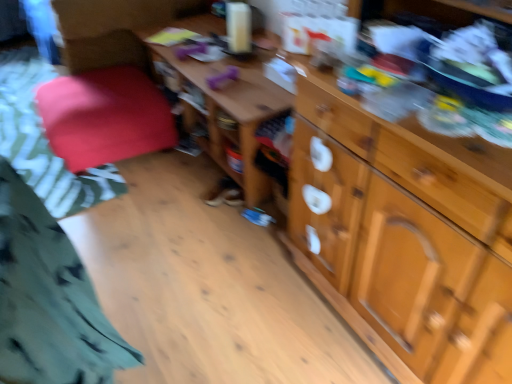
Question: Can you confirm if wooden drawer at right is taller than velvet red cushion at left?

Choices:
 (A) no
 (B) yes

Answer: (A)

Question: Considering the relative sizes of wooden drawer at right and velvet red cushion at left in the image provided, is wooden drawer at right shorter than velvet red cushion at left?

Choices:
 (A) yes
 (B) no

Answer: (A)

Question: Is wooden drawer at right closer to the viewer compared to velvet red cushion at left?

Choices:
 (A) no
 (B) yes

Answer: (B)

Question: Is wooden drawer at right outside of velvet red cushion at left?

Choices:
 (A) yes
 (B) no

Answer: (A)

Question: Considering the relative positions of wooden drawer at right and velvet red cushion at left in the image provided, is wooden drawer at right to the left of velvet red cushion at left from the viewer's perspective?

Choices:
 (A) no
 (B) yes

Answer: (A)

Question: Considering the positions of green cotton shirt at lower left and velvet red cushion at left in the image, is green cotton shirt at lower left taller or shorter than velvet red cushion at left?

Choices:
 (A) short
 (B) tall

Answer: (B)

Question: Considering the positions of green cotton shirt at lower left and velvet red cushion at left in the image, is green cotton shirt at lower left bigger or smaller than velvet red cushion at left?

Choices:
 (A) small
 (B) big

Answer: (A)

Question: Is point (69, 271) positioned closer to the camera than point (168, 130)?

Choices:
 (A) farther
 (B) closer

Answer: (B)

Question: Do you think green cotton shirt at lower left is within velvet red cushion at left, or outside of it?

Choices:
 (A) outside
 (B) inside

Answer: (A)

Question: Does point (352, 124) appear closer or farther from the camera than point (4, 155)?

Choices:
 (A) closer
 (B) farther

Answer: (A)

Question: From a real-world perspective, relative to velvet red cushion at left, is wooden drawer at right vertically above or below?

Choices:
 (A) above
 (B) below

Answer: (A)

Question: Is wooden drawer at right wider or thinner than velvet red cushion at left?

Choices:
 (A) wide
 (B) thin

Answer: (B)

Question: In terms of height, does wooden drawer at right look taller or shorter compared to velvet red cushion at left?

Choices:
 (A) tall
 (B) short

Answer: (B)

Question: From the image's perspective, relative to wooden table at center, is wooden drawer at right above or below?

Choices:
 (A) above
 (B) below

Answer: (B)

Question: In the image, is wooden drawer at right positioned in front of or behind wooden table at center?

Choices:
 (A) front
 (B) behind

Answer: (A)